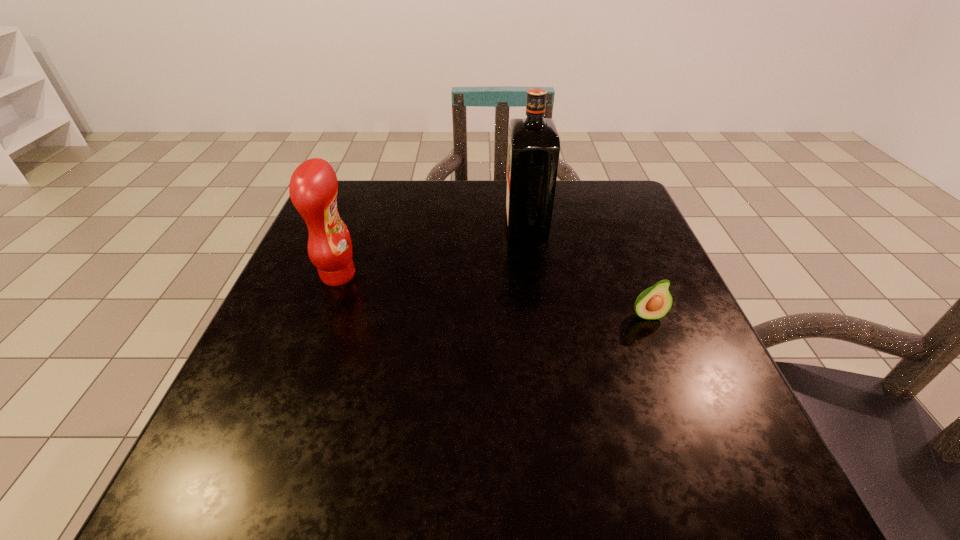
This screenshot has height=540, width=960. I want to click on the closest object relative to the shortest object, so click(x=534, y=145).